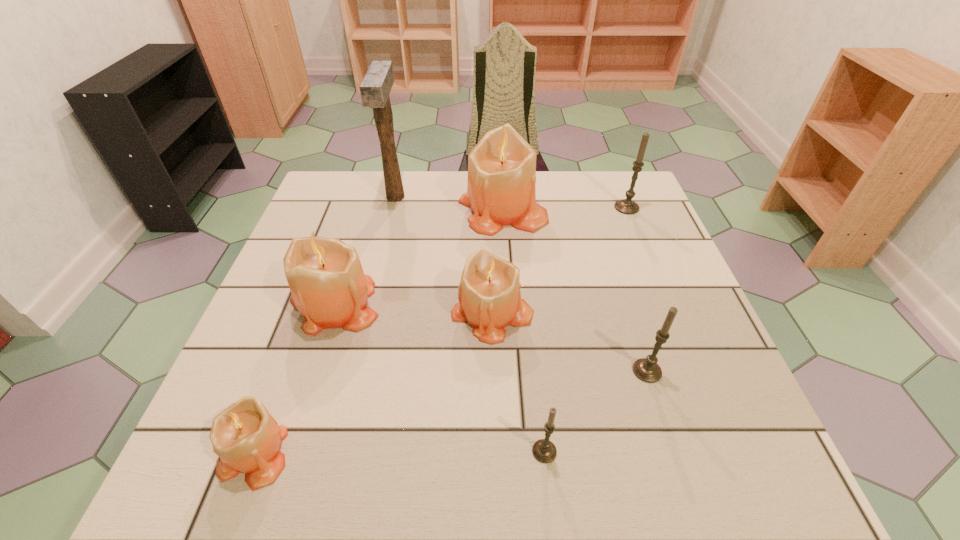
The width and height of the screenshot is (960, 540). In order to click on object at the near left corner in this screenshot , I will do 246,437.

You are a GUI agent. You are given a task and a screenshot of the screen. Output one action in this format:
    pyautogui.click(x=<x>, y=<y>)
    Task: Click on the object that is at the far right corner
    The width and height of the screenshot is (960, 540).
    Given the screenshot: What is the action you would take?
    pyautogui.click(x=626, y=206)

Locate an element on the screen. The height and width of the screenshot is (540, 960). vacant area at the far edge of the desktop is located at coordinates (388, 206).

The height and width of the screenshot is (540, 960). In order to click on blank space at the near edge of the desktop in this screenshot , I will do `click(464, 445)`.

Where is `vacant space at the left edge of the desktop`? This screenshot has height=540, width=960. vacant space at the left edge of the desktop is located at coordinates (288, 313).

Locate an element on the screen. blank space at the right edge of the desktop is located at coordinates (700, 315).

Image resolution: width=960 pixels, height=540 pixels. I want to click on vacant space at the far left corner, so click(x=319, y=215).

The width and height of the screenshot is (960, 540). Find the location of `free space at the near left corner`. free space at the near left corner is located at coordinates (276, 494).

The image size is (960, 540). Identify the location of free space at the far right corner. (645, 217).

The height and width of the screenshot is (540, 960). I want to click on empty location between the second smallest beige candle and the farthest gray candle, so click(560, 261).